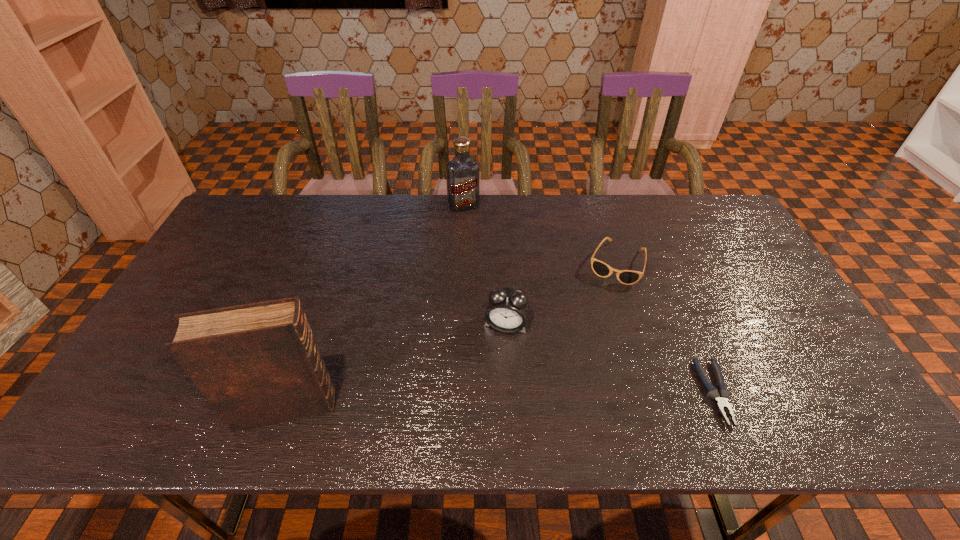
Identify the location of pliers that is at the near edge. (720, 396).

This screenshot has width=960, height=540. In the image, there is a desktop. Find the location of `vacant area at the far edge`. vacant area at the far edge is located at coordinates 452,213.

The image size is (960, 540). I want to click on vacant area at the near edge of the desktop, so click(x=593, y=366).

Locate an element on the screen. The image size is (960, 540). vacant space at the left edge of the desktop is located at coordinates (160, 364).

This screenshot has width=960, height=540. I want to click on vacant space at the right edge, so click(757, 315).

Find the location of a particular element. free region at the far left corner of the desktop is located at coordinates (273, 228).

In order to click on free space between the third farthest object and the second tallest object in this screenshot , I will do `click(485, 265)`.

Image resolution: width=960 pixels, height=540 pixels. Find the location of `empty space that is in between the leftmost object and the fourth object from right to left`. empty space that is in between the leftmost object and the fourth object from right to left is located at coordinates (374, 307).

This screenshot has height=540, width=960. In order to click on free spot between the third object from left to right and the leftmost object in this screenshot , I will do `click(396, 366)`.

The image size is (960, 540). What are the coordinates of `unoccupied position between the pliers and the farthest object` in the screenshot? It's located at (589, 299).